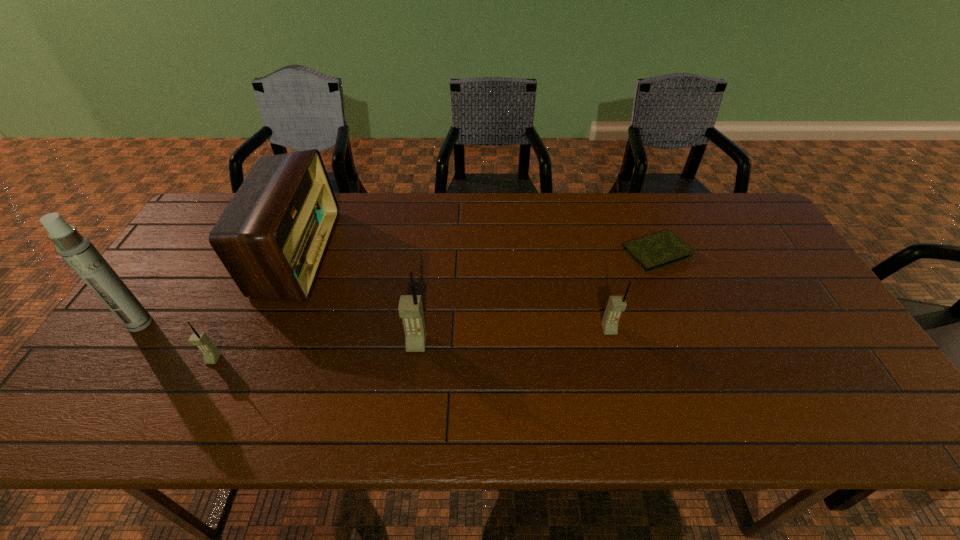
The width and height of the screenshot is (960, 540). I want to click on object present at the left edge, so click(77, 250).

Identify the location of vacant space at the far edge. This screenshot has width=960, height=540. (357, 208).

I want to click on free space at the near edge of the desktop, so click(673, 363).

At what (x,y) coordinates should I click in order to perform the action: click on free space at the right edge of the desktop. Please return your answer as a coordinate pair (x, y). Looking at the image, I should click on (806, 306).

Where is `vacant space at the far right corner`? The width and height of the screenshot is (960, 540). vacant space at the far right corner is located at coordinates (754, 234).

Where is `vacant space at the near right corner of the desktop`? vacant space at the near right corner of the desktop is located at coordinates (851, 375).

Identify the location of free space between the shortest cellular telephone and the third object from right to left. This screenshot has width=960, height=540. (315, 352).

At what (x,y) coordinates should I click in order to perform the action: click on vacant region between the aerosol can and the fourth object from left to right. Please return your answer as a coordinate pair (x, y). This screenshot has height=540, width=960. Looking at the image, I should click on (278, 334).

This screenshot has height=540, width=960. Identify the location of empty space between the second cellular telephone from right to left and the radio receiver. (356, 299).

You are a GUI agent. You are given a task and a screenshot of the screen. Output one action in this format:
    pyautogui.click(x=<x>, y=<y>)
    Task: Click on the free space between the shortest cellular telephone and the fourth object from left to right
    
    Given the screenshot: What is the action you would take?
    pyautogui.click(x=315, y=352)